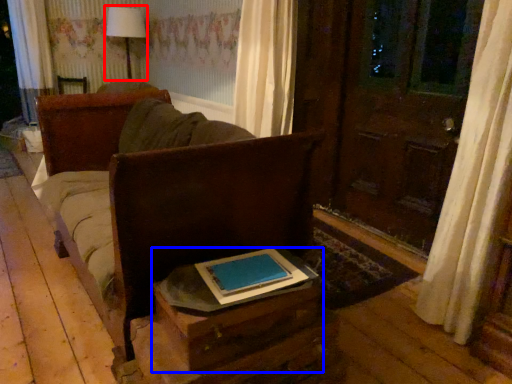
Question: Which point is closer to the camera, table lamp (highlighted by a red box) or table (highlighted by a blue box)?

Choices:
 (A) table lamp
 (B) table

Answer: (B)